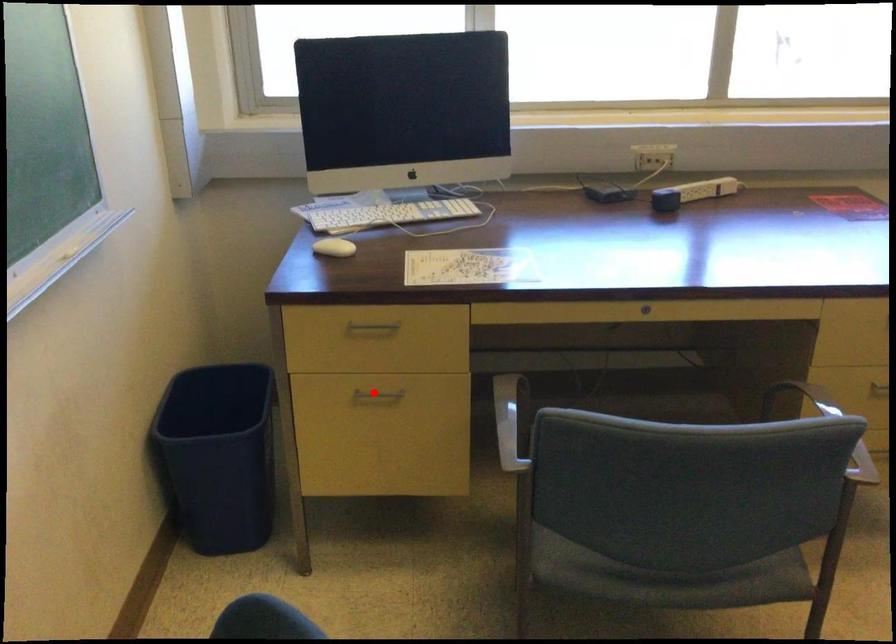
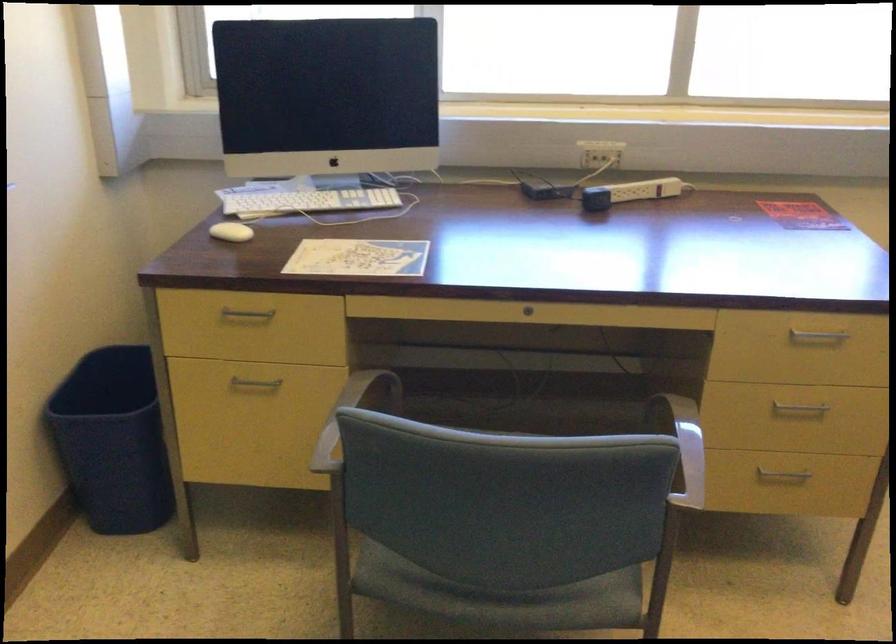
Find the pixel in the second image that matches the highlighted location in the first image.

(254, 384)